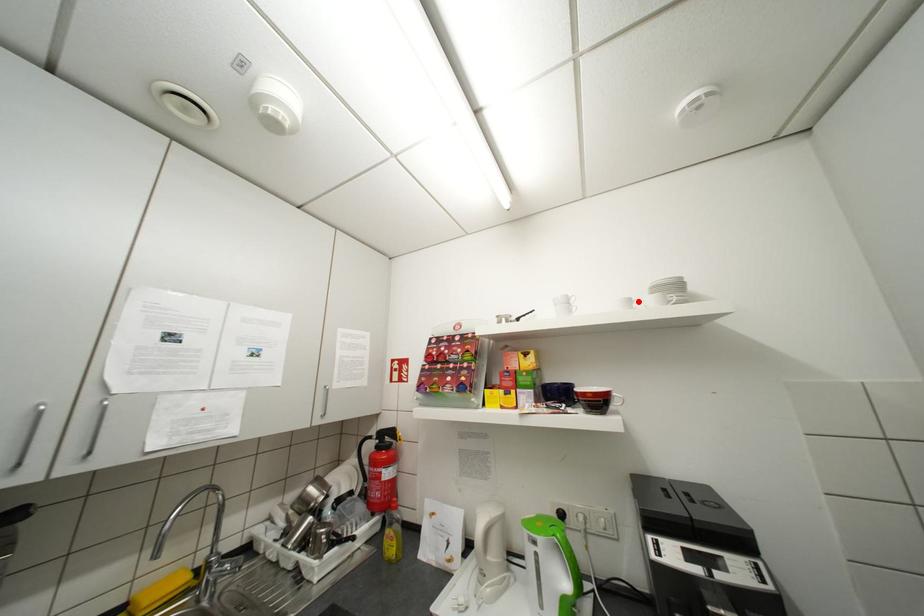
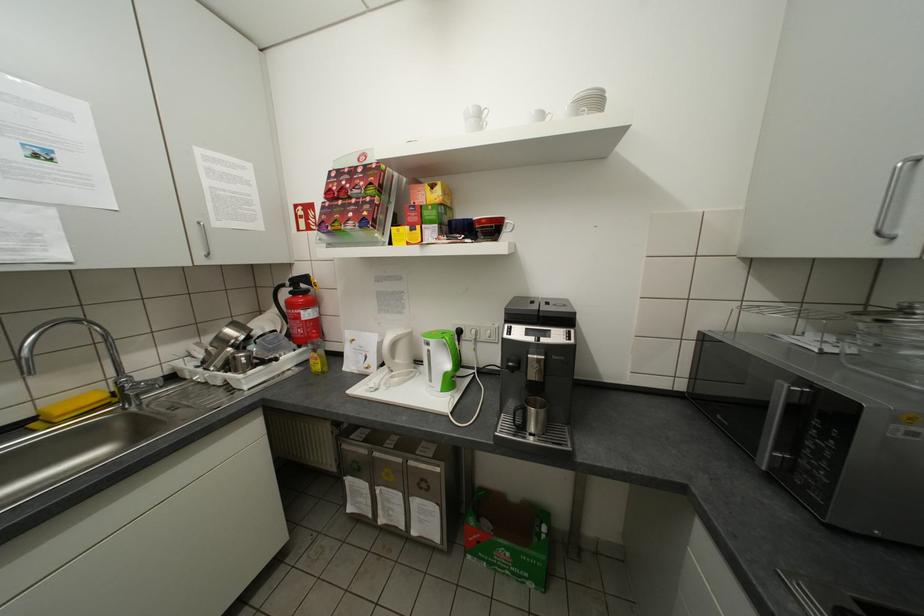
The point at the highlighted location is marked in the first image. Where is the corresponding point in the second image?

(551, 116)